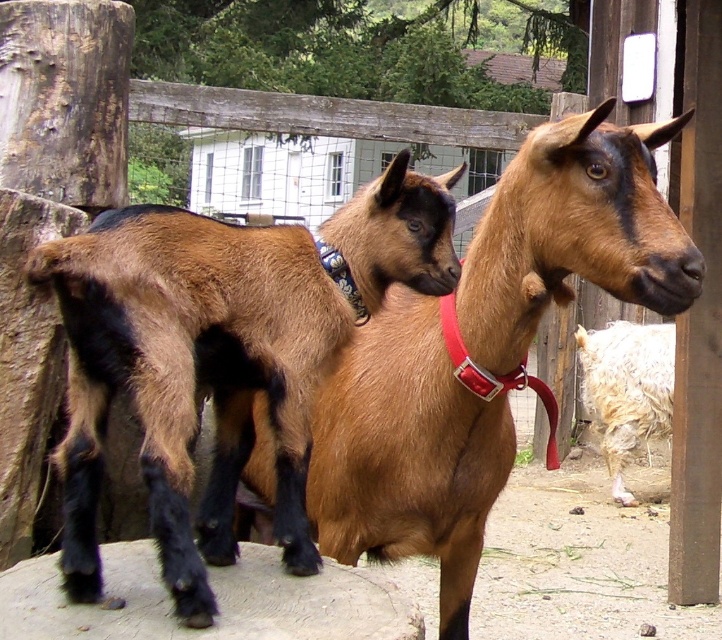
You are a farmer checking the field. You notice a smooth gray rock at center and a fluffy white goat at right. Which object is positioned higher in the image?

The smooth gray rock at center is above the fluffy white goat at right, so it is positioned higher in the image.

You are a farmer who needs to place a 30 cm wide feeding trough between the brown fuzzy goat at center and the smooth gray rock at center. Can you fit it there?

The distance between the brown fuzzy goat at center and the smooth gray rock at center is 25.77 centimeters. Since the trough is 30 cm wide, it cannot fit in the space between them.

You are a farmer trying to separate the two goats for feeding. The brown fuzzy goat at center is currently near the fence. If you need to place a divider between them that is 1.7 meters wide, will it fit between them without moving the goats?

The two goats are 1.83 meters apart. Since the divider is 1.7 meters wide, it can fit between them as the distance is greater than the divider width.